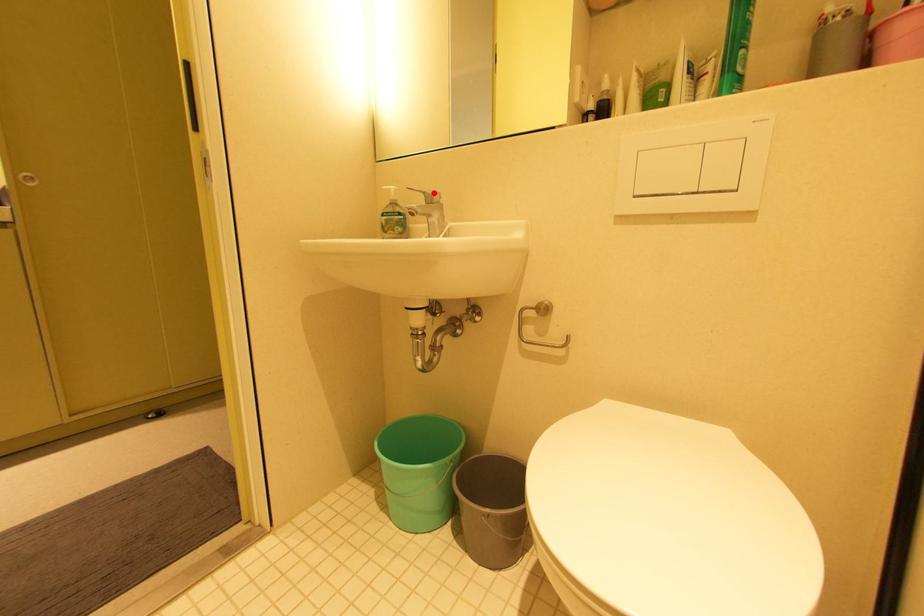
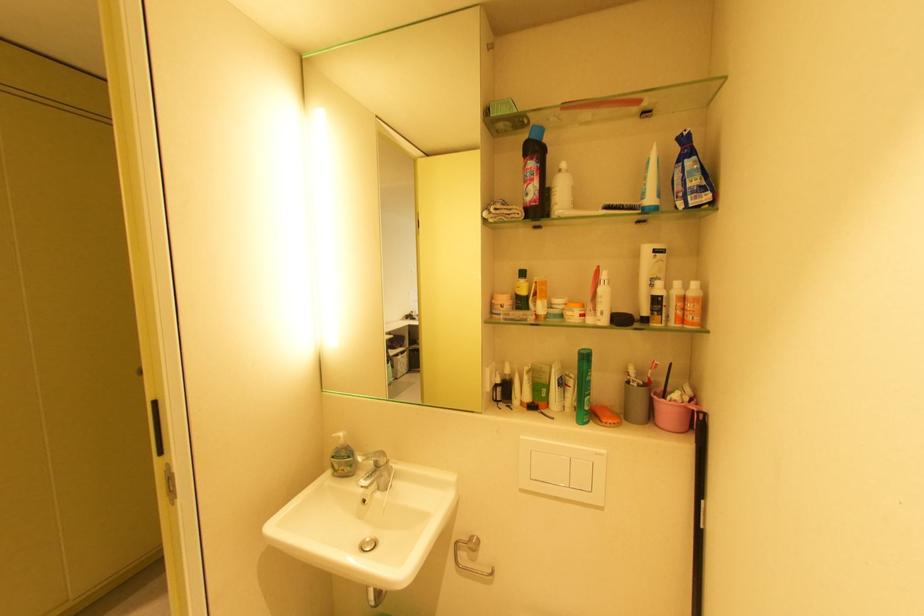
The point at the highlighted location is marked in the first image. Where is the corresponding point in the second image?

(382, 461)